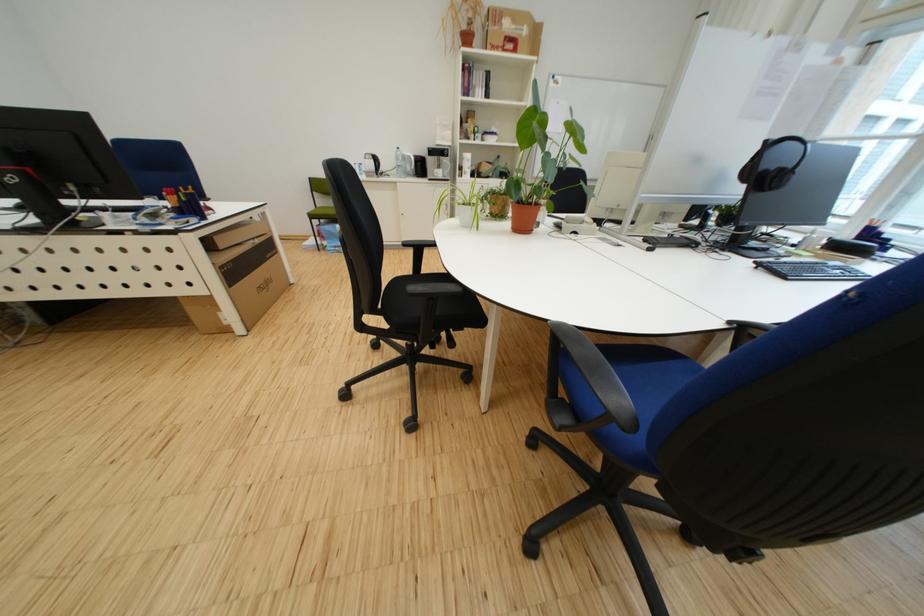
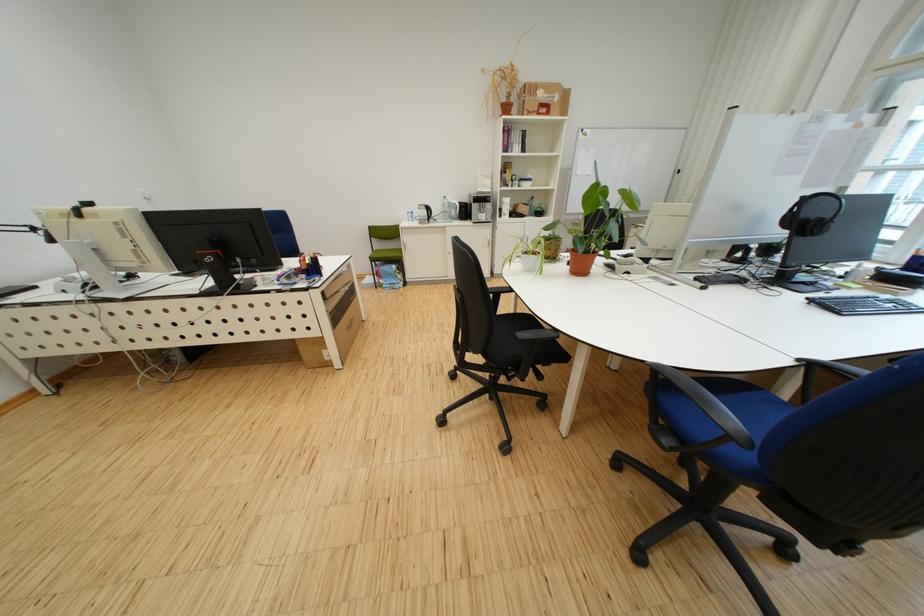
Find the pixel in the second image that matches pixel 505 50 in the first image.

(541, 115)